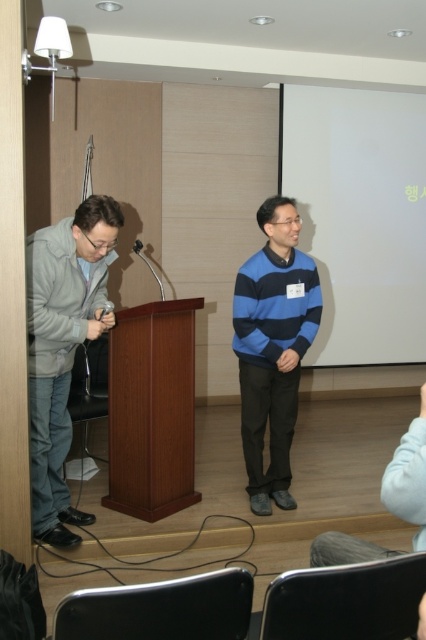
Question: Is blue striped sweater at center to the left of black plastic microphone at center from the viewer's perspective?

Choices:
 (A) no
 (B) yes

Answer: (A)

Question: Does blue striped sweater at center have a smaller size compared to matte black microphone at left?

Choices:
 (A) yes
 (B) no

Answer: (B)

Question: Does blue striped sweater at center appear on the right side of black plastic microphone at center?

Choices:
 (A) no
 (B) yes

Answer: (B)

Question: Which of these objects is positioned closest to the gray matte jacket at left?

Choices:
 (A) black plastic microphone at center
 (B) blue striped sweater at center

Answer: (B)

Question: Among these objects, which one is nearest to the camera?

Choices:
 (A) gray matte jacket at left
 (B) matte black microphone at left
 (C) black plastic microphone at center

Answer: (A)

Question: Which point is closer to the camera?

Choices:
 (A) (48, 419)
 (B) (100, 317)
 (C) (250, 278)
 (D) (138, 244)

Answer: (B)